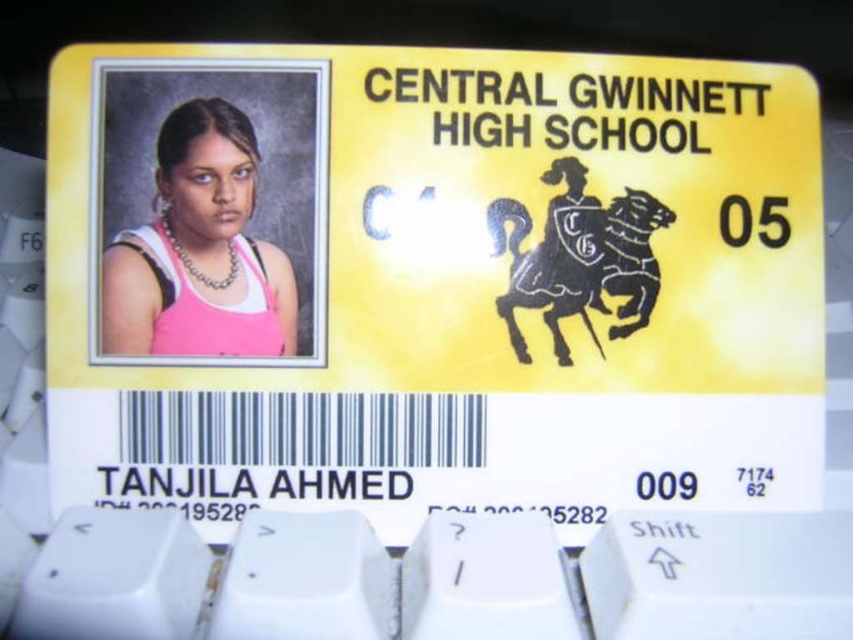
Does yellow matte plastic id card at center have a smaller size compared to pink fabric at upper left?

No.

Does yellow matte plastic id card at center have a lesser height compared to pink fabric at upper left?

No, yellow matte plastic id card at center is not shorter than pink fabric at upper left.

Which is behind, point (709, 420) or point (178, 193)?

The point (709, 420) is more distant.

Locate an element on the screen. This screenshot has height=640, width=853. yellow matte plastic id card at center is located at coordinates (432, 282).